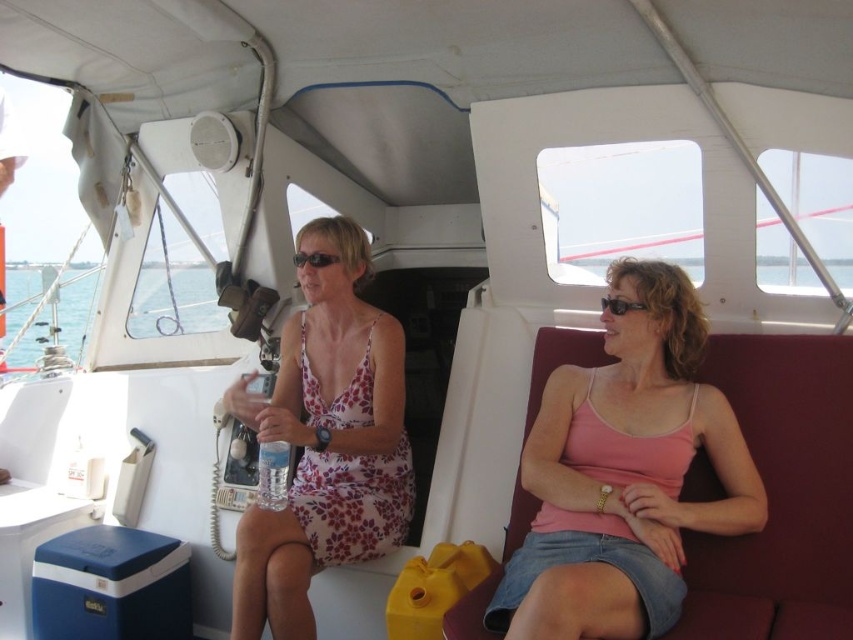
Question: Which of these objects is positioned closest to the floral fabric dress at center?

Choices:
 (A) black plastic sunglasses at center
 (B) pink fabric tank top at center
 (C) black plastic goggles at center

Answer: (A)

Question: Which point is farther to the camera?

Choices:
 (A) (260, 493)
 (B) (601, 300)
 (C) (286, 400)

Answer: (C)

Question: Can you confirm if pink fabric tank top at center is positioned to the right of clear plastic water bottle at center?

Choices:
 (A) no
 (B) yes

Answer: (B)

Question: Which object is positioned closest to the black plastic sunglasses at center?

Choices:
 (A) clear plastic water bottle at center
 (B) pink fabric tank top at center
 (C) black plastic goggles at center

Answer: (A)

Question: Is pink fabric tank top at center smaller than black plastic goggles at center?

Choices:
 (A) no
 (B) yes

Answer: (A)

Question: In this image, where is pink fabric tank top at center located relative to clear plastic water bottle at center?

Choices:
 (A) below
 (B) above

Answer: (B)